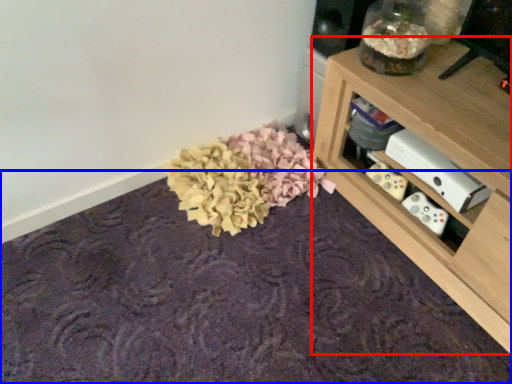
Question: Which object appears closest to the camera in this image, shelf (highlighted by a red box) or mat (highlighted by a blue box)?

Choices:
 (A) shelf
 (B) mat

Answer: (B)